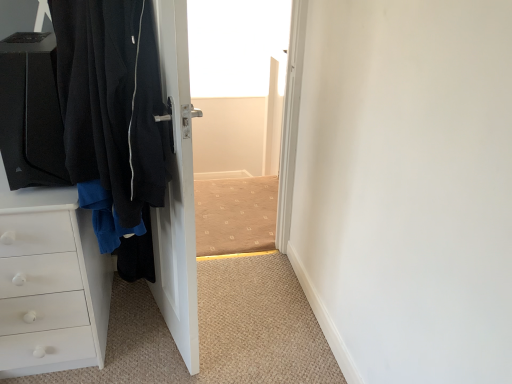
Question: Is white matte chest of drawers at left in front of or behind black fabric door at left in the image?

Choices:
 (A) front
 (B) behind

Answer: (B)

Question: Considering the positions of white matte chest of drawers at left and black fabric door at left in the image, is white matte chest of drawers at left wider or thinner than black fabric door at left?

Choices:
 (A) thin
 (B) wide

Answer: (B)

Question: Is white matte chest of drawers at left inside the boundaries of black fabric door at left, or outside?

Choices:
 (A) outside
 (B) inside

Answer: (A)

Question: Is black fabric door at left taller or shorter than white matte chest of drawers at left?

Choices:
 (A) tall
 (B) short

Answer: (A)

Question: From the image's perspective, is black fabric door at left positioned above or below white matte chest of drawers at left?

Choices:
 (A) below
 (B) above

Answer: (B)

Question: Looking at their shapes, would you say black fabric door at left is wider or thinner than white matte chest of drawers at left?

Choices:
 (A) thin
 (B) wide

Answer: (A)

Question: Is point (186, 193) closer or farther from the camera than point (8, 289)?

Choices:
 (A) closer
 (B) farther

Answer: (A)